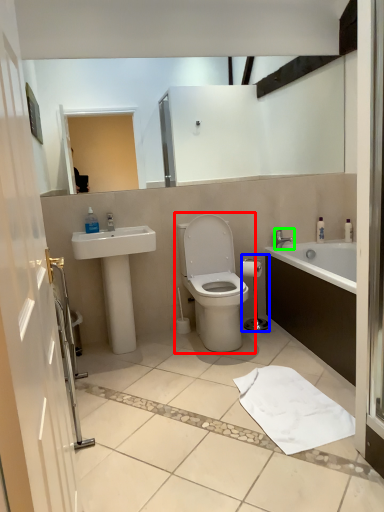
Question: Which is farther away from toilet (highlighted by a red box)? shower (highlighted by a blue box) or tap (highlighted by a green box)?

Choices:
 (A) shower
 (B) tap

Answer: (B)